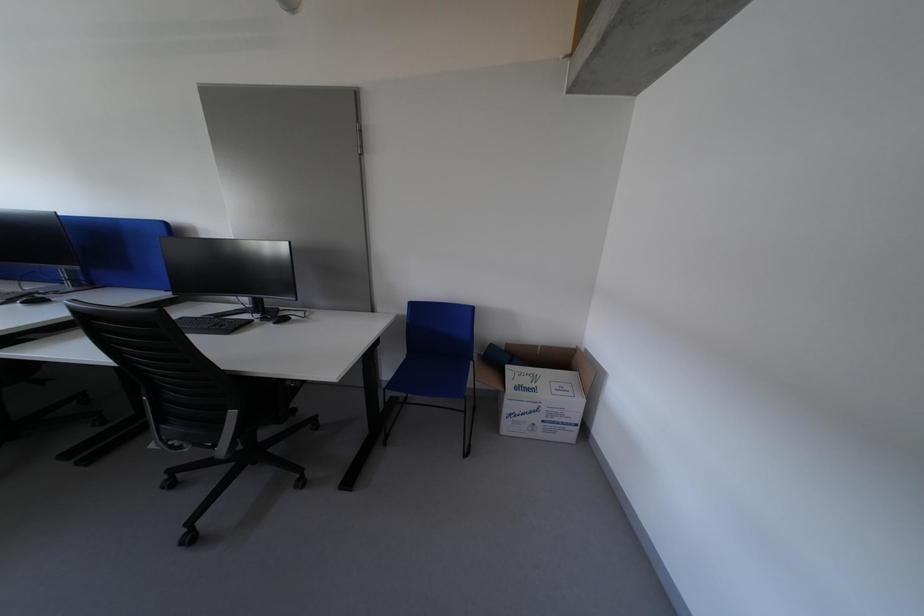
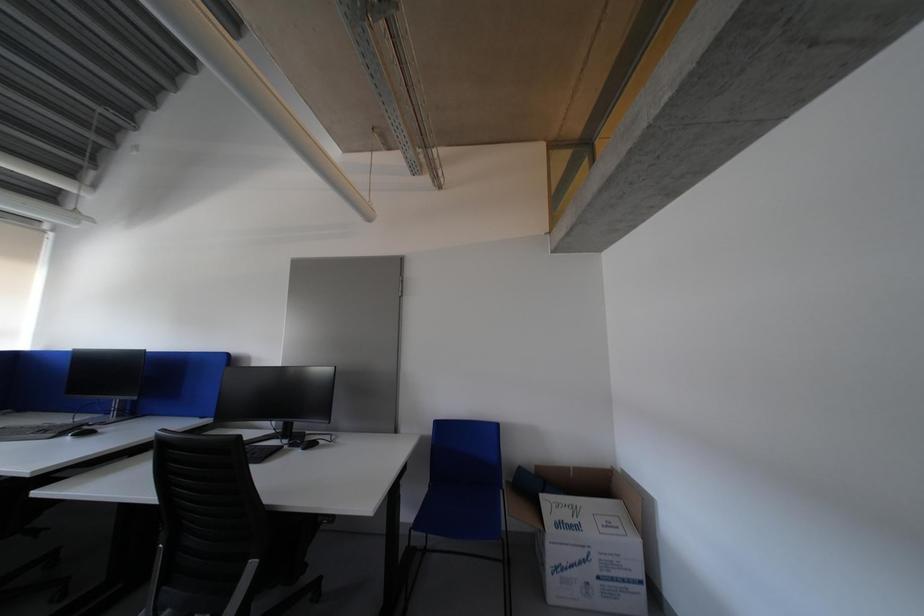
The images are taken continuously from a first-person perspective. In which direction are you moving?

The movement direction of the cameraman is left, backward.